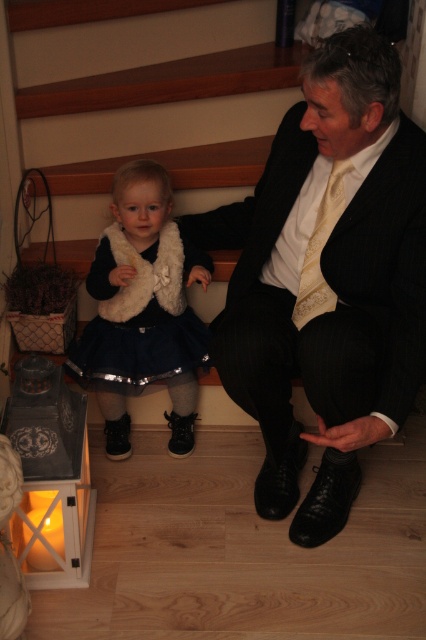
Can you confirm if matte black suit at center is thinner than navy blue satin dress at lower left?

Incorrect, matte black suit at center's width is not less than navy blue satin dress at lower left's.

Who is positioned more to the left, matte black suit at center or navy blue satin dress at lower left?

From the viewer's perspective, navy blue satin dress at lower left appears more on the left side.

Does point (331, 70) come closer to viewer compared to point (198, 332)?

Yes, point (331, 70) is in front of point (198, 332).

At what (x,y) coordinates should I click in order to perform the action: click on matte black suit at center. Please return your answer as a coordinate pair (x, y). Image resolution: width=426 pixels, height=640 pixels. Looking at the image, I should click on (327, 280).

Which is in front, point (132, 298) or point (302, 278)?

Point (302, 278) is more forward.

Is point (118, 324) positioned in front of point (324, 196)?

That is False.

Describe the element at coordinates (140, 316) in the screenshot. Image resolution: width=426 pixels, height=640 pixels. I see `navy blue satin dress at lower left` at that location.

The height and width of the screenshot is (640, 426). I want to click on navy blue satin dress at lower left, so click(140, 316).

What do you see at coordinates (327, 280) in the screenshot? I see `matte black suit at center` at bounding box center [327, 280].

Between matte black suit at center and yellow textured tie at center, which one has more height?

matte black suit at center is taller.

Which is behind, point (238, 273) or point (296, 320)?

Positioned behind is point (238, 273).

Locate an element on the screen. Image resolution: width=426 pixels, height=640 pixels. matte black suit at center is located at coordinates (327, 280).